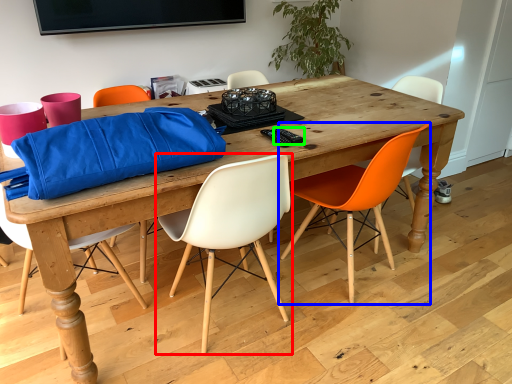
Question: Which is farther away from chair (highlighted by a red box)? chair (highlighted by a blue box) or remote control (highlighted by a green box)?

Choices:
 (A) chair
 (B) remote control

Answer: (A)